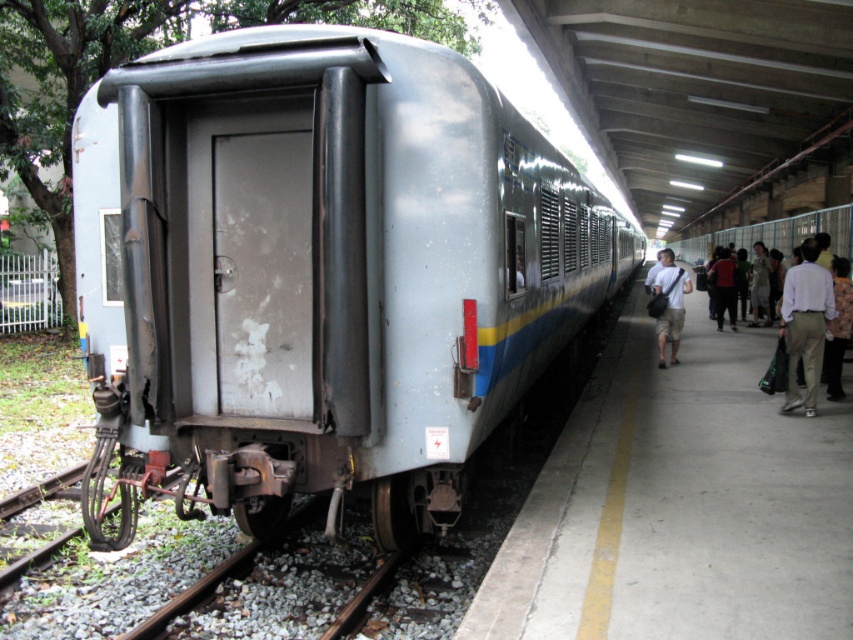
You are a delivery person carrying a 3 meter long pipe. You are standing on the concrete platform at lower center and need to place the pipe next to the light brown fabric bag at center. Is there enough space between them to lay the pipe horizontally?

The distance between the concrete platform at lower center and the light brown fabric bag at center is 2.99 meters. Since the pipe is 3 meters long, it is slightly longer than the available space, so there isn not enough room to lay the pipe horizontally between them.